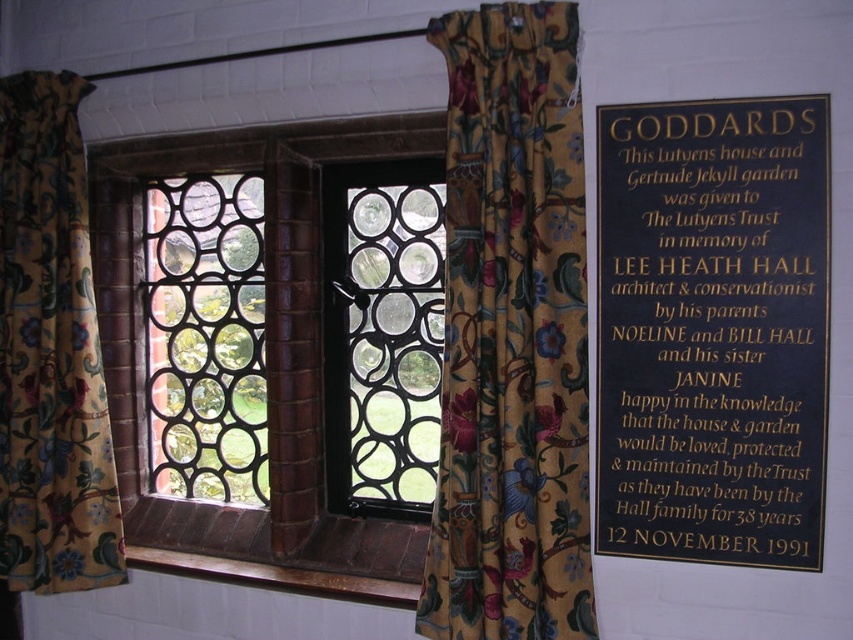
You are standing in the room and want to see the outside view through the window. Since the black ironwork window at center has circular cutouts, can you see the outside clearly through the clear glass at center?

The black ironwork window at center is in front of the clear glass at center, so the ironwork window with its circular cutouts blocks part of the clear glass, allowing only partial visibility through the clear glass at center.